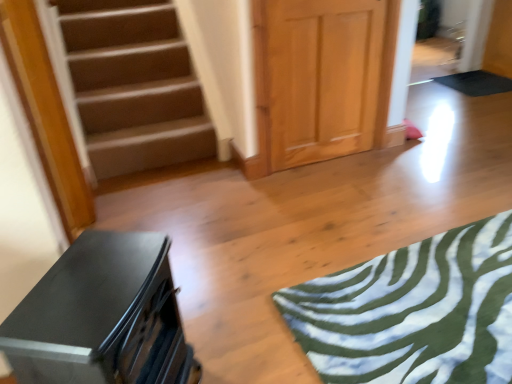
Where is `vacant space underneath green fabric yoga mat at lower right, arranged as the 1th yoga mat when viewed from the left (from a real-world perspective)`? The height and width of the screenshot is (384, 512). vacant space underneath green fabric yoga mat at lower right, arranged as the 1th yoga mat when viewed from the left (from a real-world perspective) is located at coordinates (436, 303).